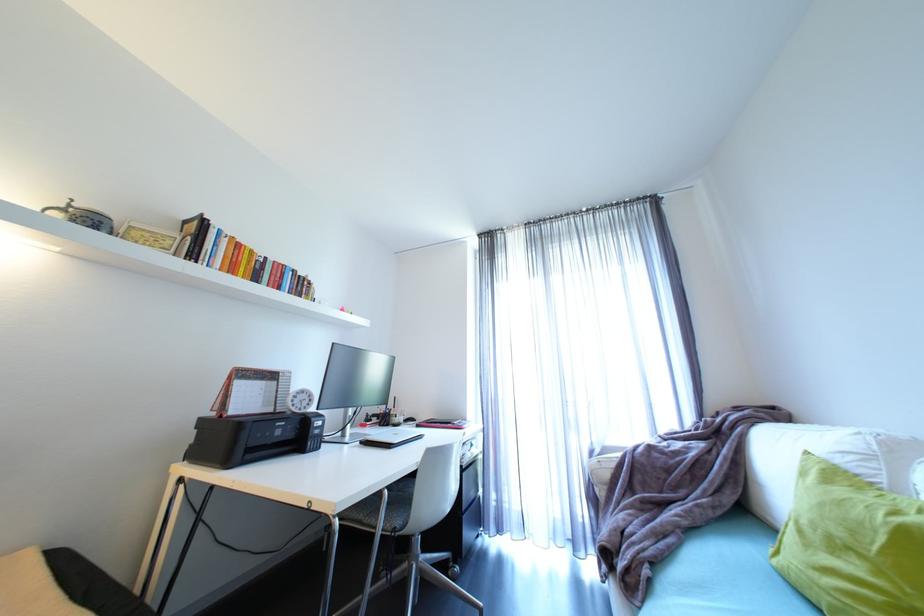
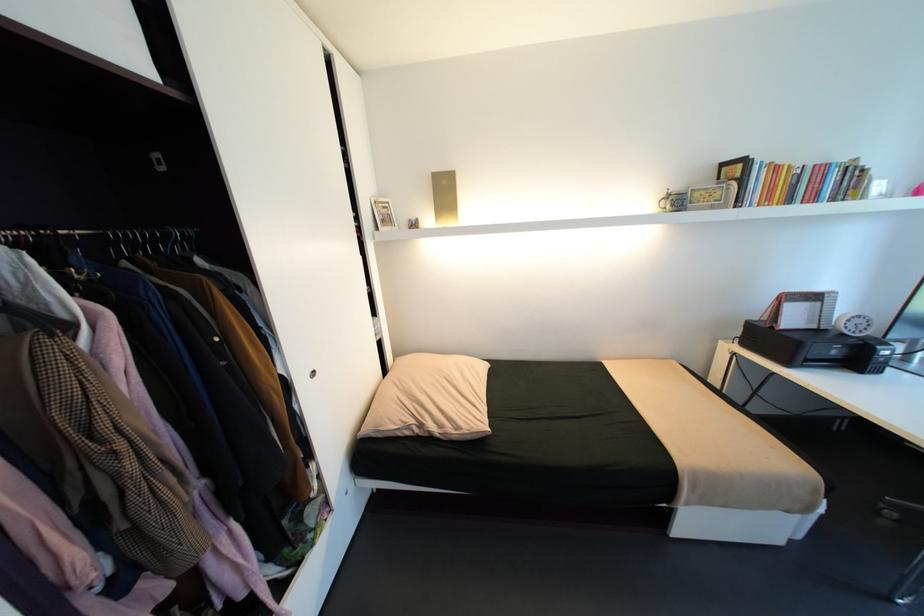
The point at (282,262) is marked in the first image. Where is the corresponding point in the second image?

(821, 166)